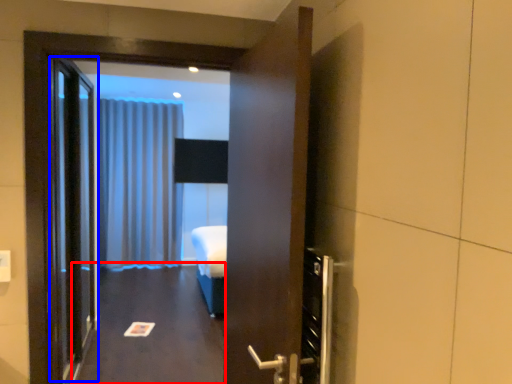
Question: Which of the following is the farthest to the observer, corridor (highlighted by a red box) or elevator door (highlighted by a blue box)?

Choices:
 (A) corridor
 (B) elevator door

Answer: (A)